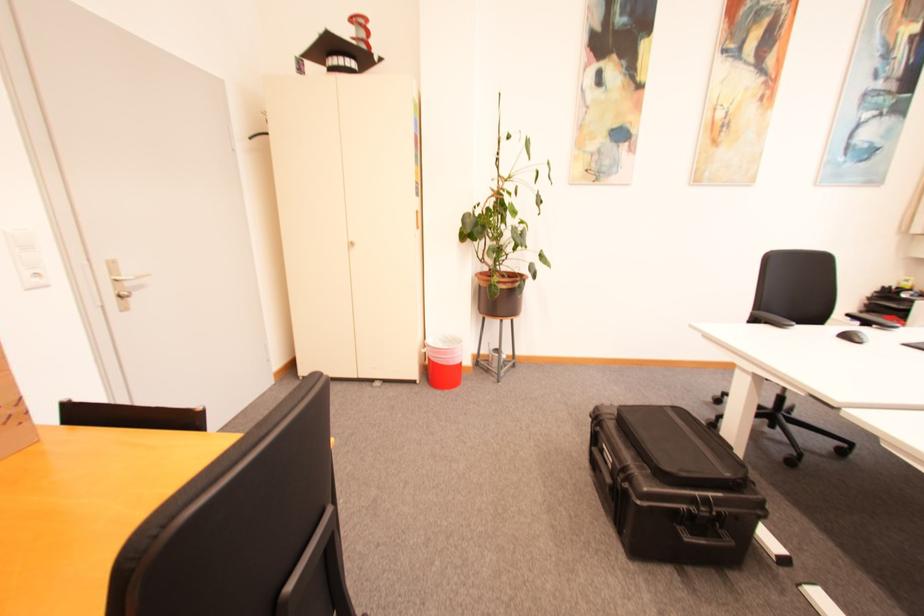
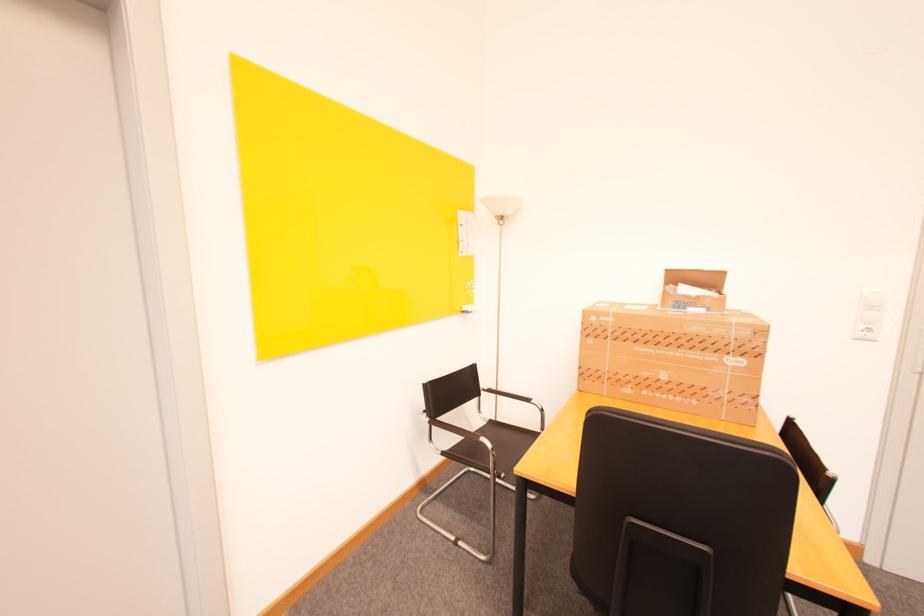
In the second image, find the point that corresponds to (x=35, y=290) in the first image.

(862, 339)